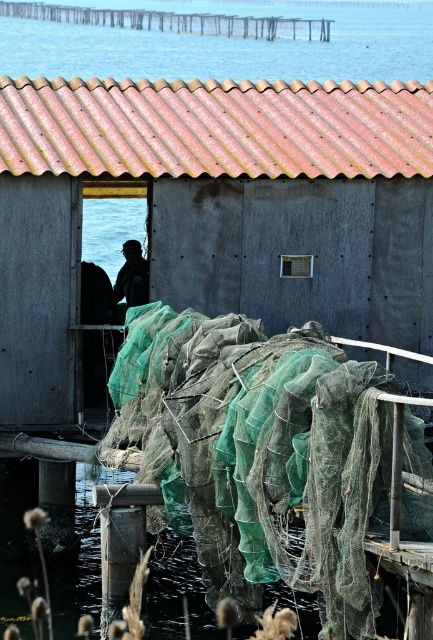
Question: Among these objects, which one is nearest to the camera?

Choices:
 (A) transparent blue water at upper center
 (B) rustic corrugated metal hut at center
 (C) dark blue fabric fisherman at center

Answer: (C)

Question: Does transparent blue water at upper center lie behind dark blue fabric fisherman at center?

Choices:
 (A) no
 (B) yes

Answer: (B)

Question: Which point is farther to the camera?

Choices:
 (A) transparent blue water at upper center
 (B) dark blue fabric fisherman at center

Answer: (A)

Question: Which object is farther from the camera taking this photo?

Choices:
 (A) transparent blue water at upper center
 (B) dark blue fabric fisherman at center

Answer: (A)

Question: Is rustic corrugated metal hut at center bigger than dark blue fabric fisherman at center?

Choices:
 (A) yes
 (B) no

Answer: (B)

Question: Is rustic corrugated metal hut at center closer to camera compared to transparent blue water at upper center?

Choices:
 (A) no
 (B) yes

Answer: (B)